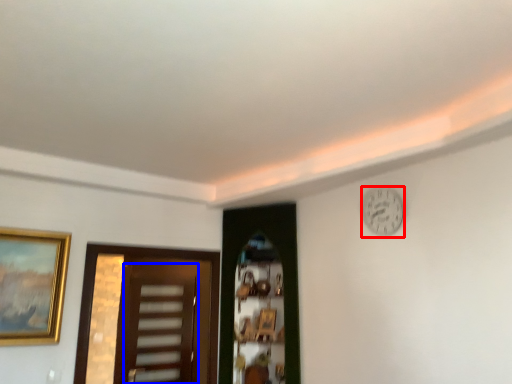
Question: Which point is further to the camera, clock (highlighted by a red box) or screen door (highlighted by a blue box)?

Choices:
 (A) clock
 (B) screen door

Answer: (B)